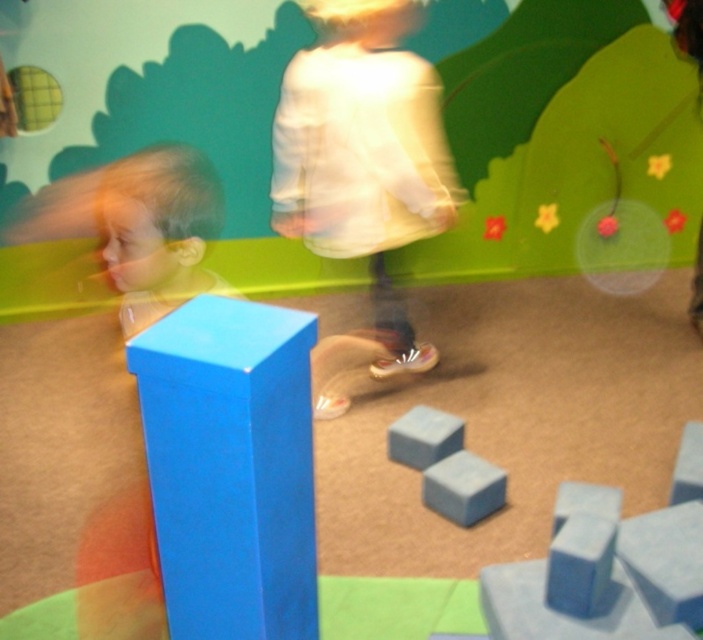
Question: Estimate the real-world distances between objects in this image. Which object is closer to the matte blue cube at center?

Choices:
 (A) smooth gray cube at center
 (B) blue matte block at center

Answer: (B)

Question: Which of the following is the closest to the observer?

Choices:
 (A) (243, 522)
 (B) (425, 504)

Answer: (A)

Question: Considering the relative positions of blue matte block at center and smooth gray cube at center in the image provided, where is blue matte block at center located with respect to smooth gray cube at center?

Choices:
 (A) above
 (B) below

Answer: (B)

Question: Is matte blue cube at center wider than blue matte block at center?

Choices:
 (A) yes
 (B) no

Answer: (A)

Question: Which object is farther from the camera taking this photo?

Choices:
 (A) smooth gray cube at center
 (B) blue matte block at center

Answer: (A)

Question: Can you confirm if matte blue cube at center is smaller than blue matte block at center?

Choices:
 (A) no
 (B) yes

Answer: (A)